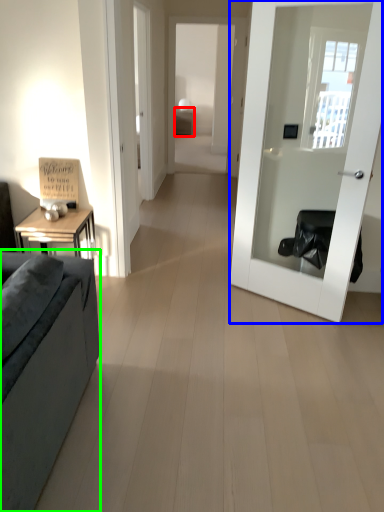
Question: Based on their relative distances, which object is nearer to table (highlighted by a red box)? Choose from door (highlighted by a blue box) and studio couch (highlighted by a green box).

Choices:
 (A) door
 (B) studio couch

Answer: (A)